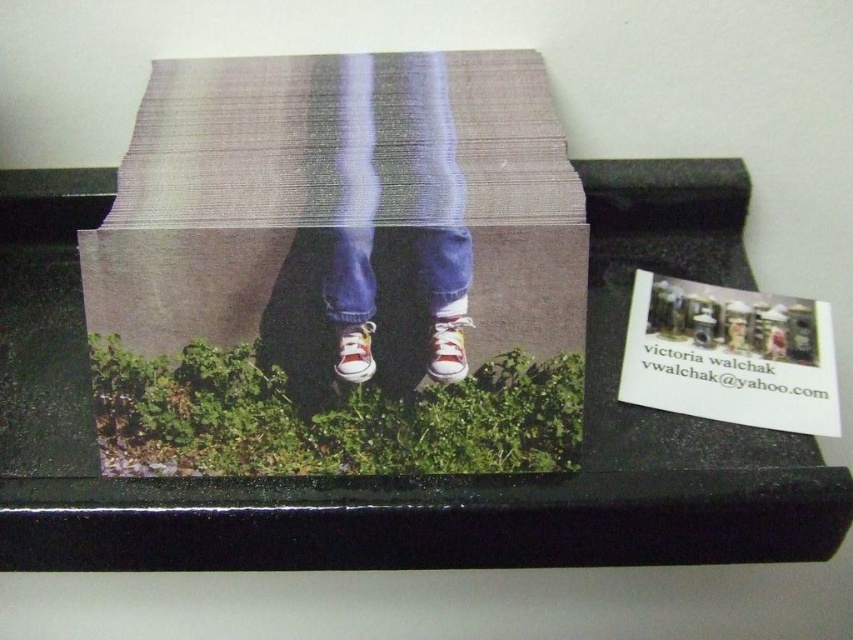
Is point (418, 230) positioned in front of point (448, 365)?

Yes, it is in front of point (448, 365).

Which is behind, point (347, 81) or point (448, 328)?

The point (347, 81) is more distant.

Where is `matte canvas pants at center`? This screenshot has width=853, height=640. matte canvas pants at center is located at coordinates (440, 218).

How distant is matte canvas pants at center from red canvas shoe at center?

matte canvas pants at center is 6.39 inches away from red canvas shoe at center.

Which is behind, point (323, 298) or point (358, 326)?

The point (358, 326) is more distant.

This screenshot has width=853, height=640. Identify the location of matte canvas pants at center. (440, 218).

Find the location of a particular element. This screenshot has width=853, height=640. matte canvas pants at center is located at coordinates (440, 218).

Does matte cardboard box at center have a greater width compared to matte canvas pants at center?

Yes, matte cardboard box at center is wider than matte canvas pants at center.

In the scene shown: Which of these two, matte cardboard box at center or matte canvas pants at center, stands shorter?

With less height is matte cardboard box at center.

Which is behind, point (451, 136) or point (421, 253)?

The point (451, 136) is behind.

Identify the location of matte cardboard box at center. (343, 196).